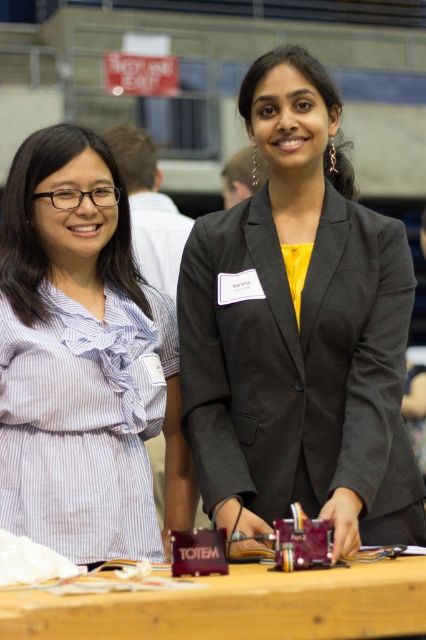
Question: Which object is positioned closest to the wooden table at center?

Choices:
 (A) matte black blazer at center
 (B) white striped shirt at left

Answer: (A)

Question: Which object appears closest to the camera in this image?

Choices:
 (A) white striped shirt at left
 (B) matte black blazer at center
 (C) wooden table at center

Answer: (C)

Question: Does white striped shirt at left appear on the right side of wooden table at center?

Choices:
 (A) yes
 (B) no

Answer: (B)

Question: Does matte black blazer at center have a lesser width compared to wooden table at center?

Choices:
 (A) no
 (B) yes

Answer: (B)

Question: Which point appears closest to the camera in this image?

Choices:
 (A) (379, 403)
 (B) (235, 620)
 (C) (22, 500)

Answer: (B)

Question: Is matte black blazer at center positioned in front of wooden table at center?

Choices:
 (A) yes
 (B) no

Answer: (B)